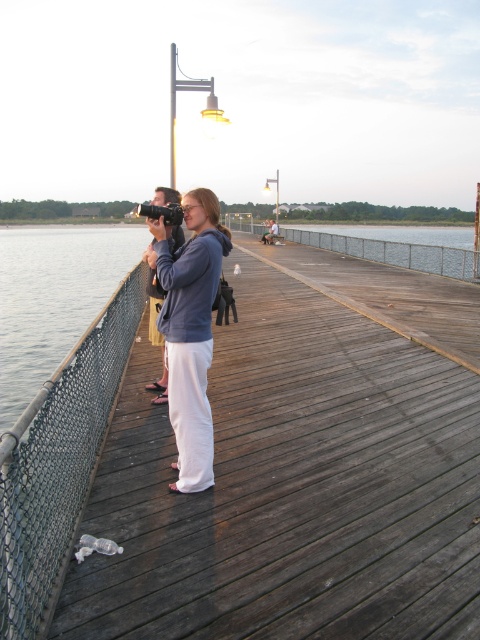
From the picture: You are standing on the wooden pier and see two points marked in the scene. Which point, point (243, 499) or point (166, 305), is nearer to you?

Point (243, 499) is closer to the viewer than point (166, 305).

Based on the photo, you are trying to take a photo of the dark wood dock at center and the matte gray hoodie at center from the left side of the pier. Which object should you aim your camera at first to capture both in the frame?

The matte gray hoodie at center should be aimed at first since the dark wood dock at center is positioned to its right. By starting with the matte gray hoodie at center, you can ensure both objects are included in the frame as the dock is to the right of the hoodie.

You are standing on the pier and want to take a photo of the dark wood dock at center from the matte gray hoodie at center position. The camera you have can focus objects up to 5 meters away. Will you be able to capture the dock clearly?

The dark wood dock at center is 5.53 meters away from the matte gray hoodie at center. Since the camera can only focus up to 5 meters, the distance is too far to capture the dock clearly.